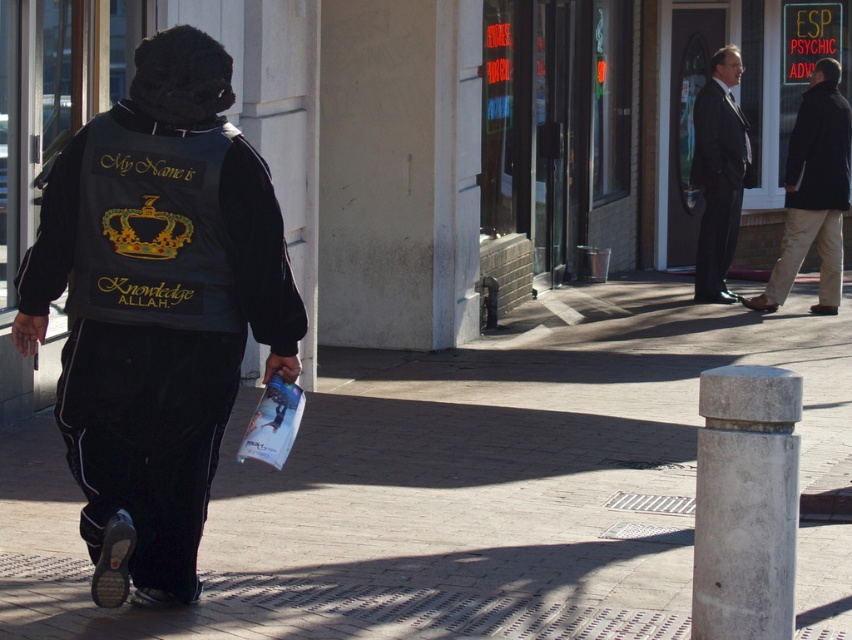
Between black matte jacket at center and black matte suit at upper right, which one has more height?

Standing taller between the two is black matte suit at upper right.

Does black matte jacket at center appear on the left side of black matte suit at upper right?

Correct, you'll find black matte jacket at center to the left of black matte suit at upper right.

Is point (66, 268) behind point (714, 104)?

No, (66, 268) is closer to viewer.

Locate an element on the screen. The image size is (852, 640). black matte jacket at center is located at coordinates (260, 248).

Is black glossy suit at right shorter than black matte suit at upper right?

In fact, black glossy suit at right may be taller than black matte suit at upper right.

Measure the distance between point (735, 81) and camera.

A distance of 15.06 meters exists between point (735, 81) and camera.

Locate an element on the screen. Image resolution: width=852 pixels, height=640 pixels. black glossy suit at right is located at coordinates (718, 173).

Is velvet black jacket at center to the left of black matte jacket at center from the viewer's perspective?

No, velvet black jacket at center is not to the left of black matte jacket at center.

Who is taller, velvet black jacket at center or black matte jacket at center?

velvet black jacket at center

Measure the distance between point [106,378] and camera.

They are 5.34 meters apart.

Where is `velvet black jacket at center`? velvet black jacket at center is located at coordinates (157, 308).